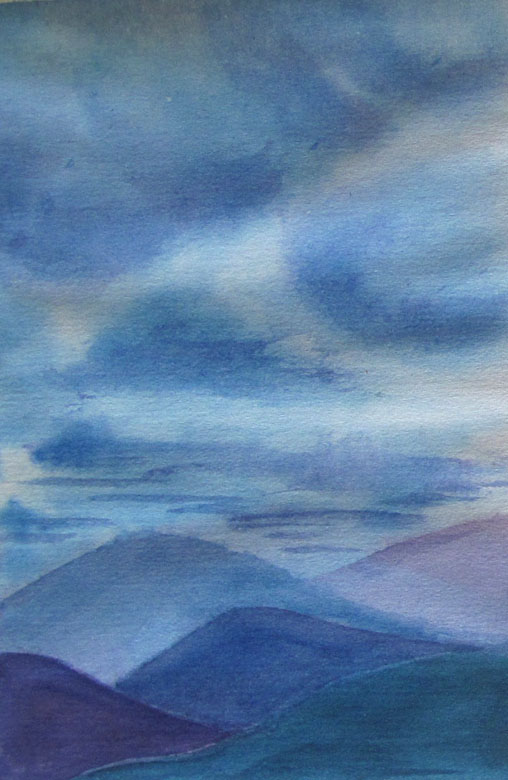
What are the coordinates of `1 painting` in the screenshot? It's located at (240, 231).